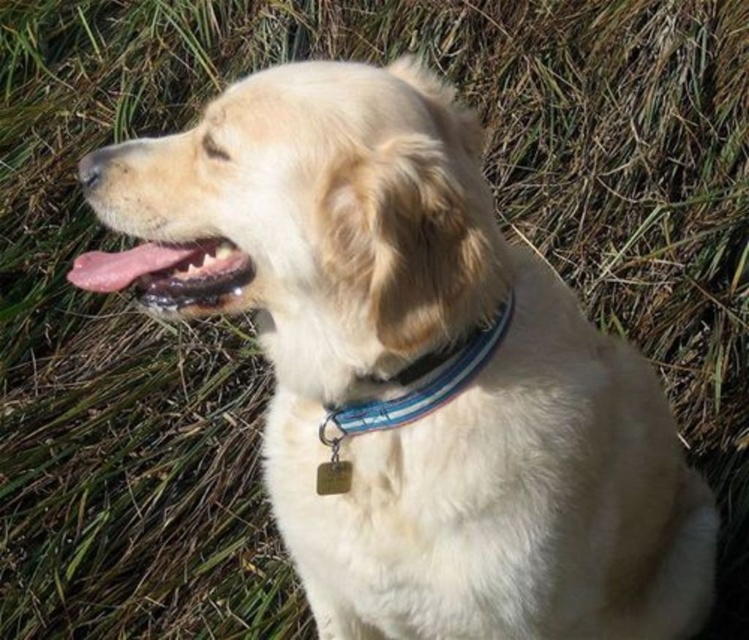
You are a veterinarian examining a golden retriever dog. You notice the pink glossy tongue at center and the blue fabric collar at center. Which object has a smaller width?

The pink glossy tongue at center has a smaller width than the blue fabric collar at center.